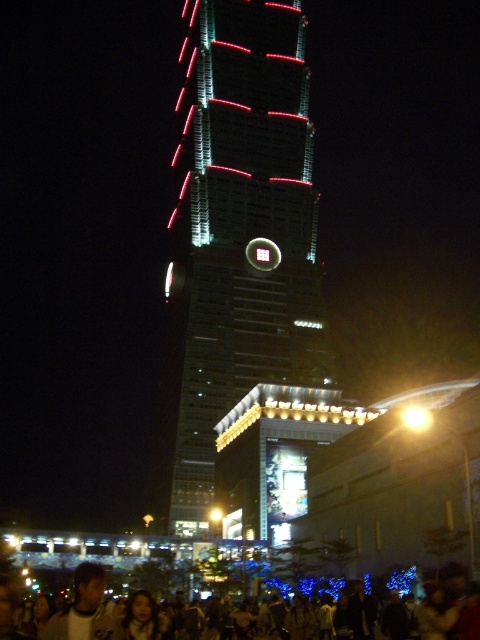
Question: Which object is farther from the camera taking this photo?

Choices:
 (A) glassy reflective skyscraper at center
 (B) smooth skin face at lower center
 (C) light brown hair at lower left

Answer: (A)

Question: Is dark clothing crowd at lower center above light brown hair at lower left?

Choices:
 (A) no
 (B) yes

Answer: (A)

Question: Is glassy reflective skyscraper at center above smooth skin face at lower center?

Choices:
 (A) no
 (B) yes

Answer: (B)

Question: Among these objects, which one is nearest to the camera?

Choices:
 (A) smooth skin face at lower center
 (B) light brown hair at lower left

Answer: (B)

Question: Which point is closer to the camera?

Choices:
 (A) smooth skin face at lower center
 (B) dark clothing crowd at lower center

Answer: (B)

Question: In this image, where is glassy reflective skyscraper at center located relative to smooth skin face at lower center?

Choices:
 (A) right
 (B) left

Answer: (B)